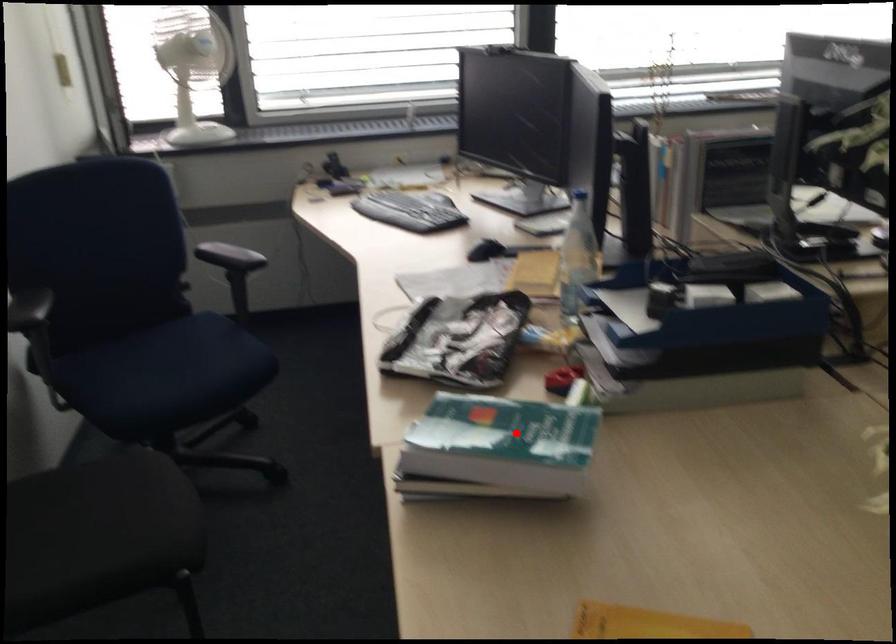
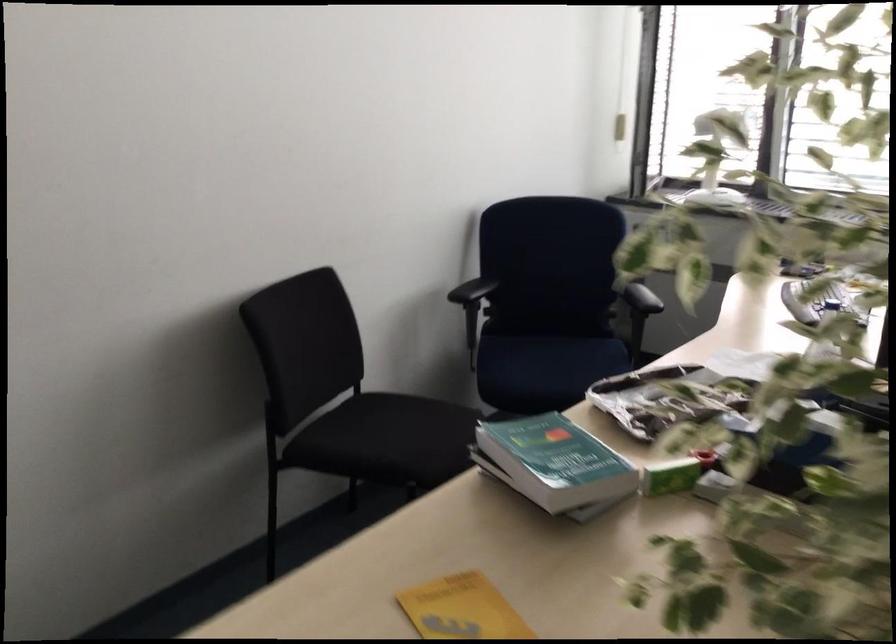
Locate, in the second image, the point that corresponds to the highlighted location in the first image.

(554, 462)